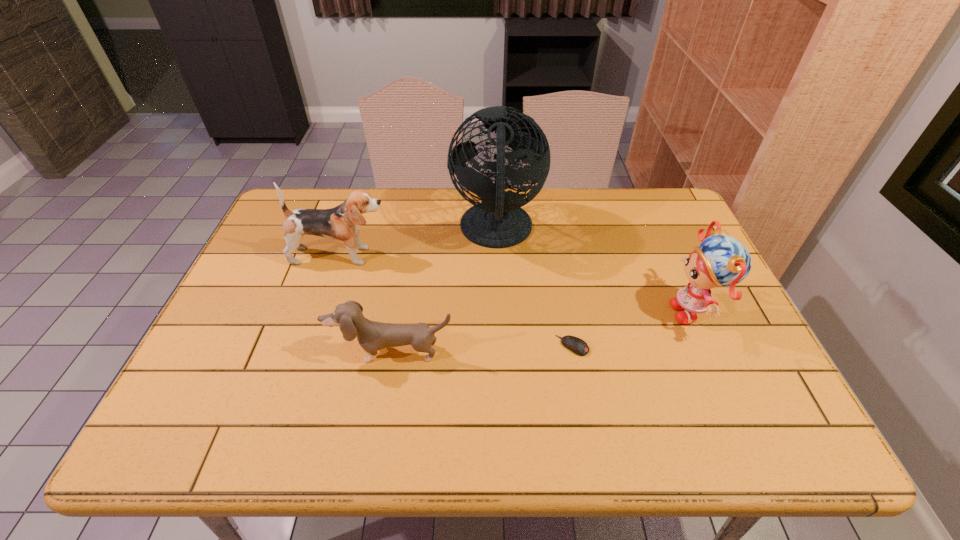
In order to click on vacant area that lies between the tallest object and the rightmost object in this screenshot , I will do `click(595, 271)`.

Where is `vacant area between the globe and the taller puppy`? This screenshot has width=960, height=540. vacant area between the globe and the taller puppy is located at coordinates (419, 244).

You are a GUI agent. You are given a task and a screenshot of the screen. Output one action in this format:
    pyautogui.click(x=<x>, y=<y>)
    Task: Click on the object that is the second closest to the taller puppy
    The height and width of the screenshot is (540, 960).
    Given the screenshot: What is the action you would take?
    pyautogui.click(x=372, y=336)

The width and height of the screenshot is (960, 540). Find the location of `object that is the third closest to the doll`. object that is the third closest to the doll is located at coordinates (372, 336).

Locate an element on the screen. This screenshot has height=540, width=960. free location that satisfies the following two spatial constraints: 1. on the front-facing side of the shortest object; 2. on the left side of the globe is located at coordinates (501, 346).

Locate an element on the screen. free space that satisfies the following two spatial constraints: 1. at the face of the taller puppy; 2. on the left side of the shortest object is located at coordinates (311, 346).

This screenshot has width=960, height=540. In order to click on vacant space that satisfies the following two spatial constraints: 1. at the face of the taller puppy; 2. on the back side of the shortest object in this screenshot , I will do `click(311, 346)`.

I want to click on vacant region that satisfies the following two spatial constraints: 1. on the face of the doll; 2. on the front side of the computer mouse, so click(x=709, y=346).

Where is `vacant area in the image that satisfies the following two spatial constraints: 1. at the face of the taller puppy; 2. on the right side of the computer mouse`? vacant area in the image that satisfies the following two spatial constraints: 1. at the face of the taller puppy; 2. on the right side of the computer mouse is located at coordinates (311, 346).

At what (x,y) coordinates should I click in order to perform the action: click on vacant area that satisfies the following two spatial constraints: 1. on the front-facing side of the globe; 2. on the right side of the computer mouse. Please return your answer as a coordinate pair (x, y). The height and width of the screenshot is (540, 960). Looking at the image, I should click on (501, 346).